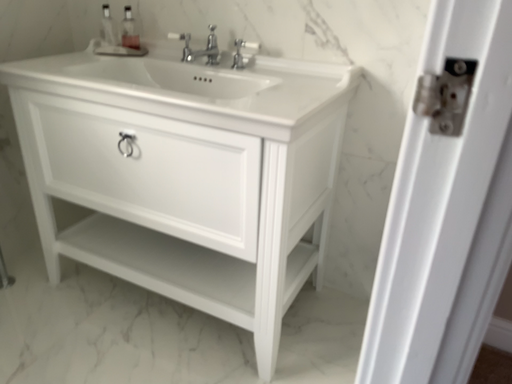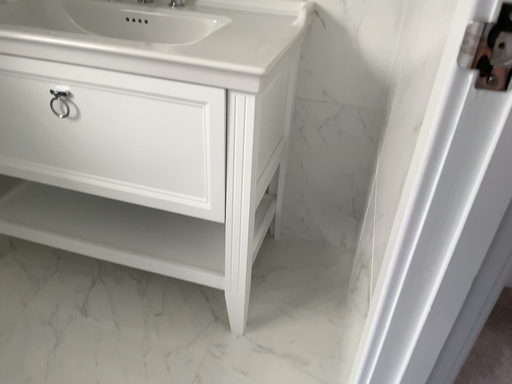
Question: Which way did the camera rotate in the video?

Choices:
 (A) rotated left
 (B) rotated right

Answer: (B)